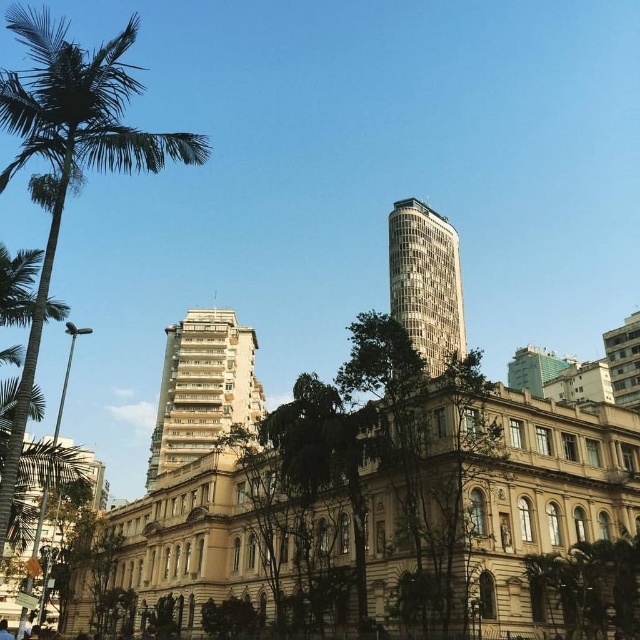
You are standing in the city square and see the green leafy palm tree at left and the silver glass tower at upper right. Which object is positioned more to the left side of the scene?

The green leafy palm tree at left is positioned more to the left side of the scene compared to the silver glass tower at upper right.

You are standing in the middle of the street looking at the white textured building at center and the silver glass tower at upper right. Which one is positioned to the left when viewed from your perspective?

The white textured building at center is positioned to the left of the silver glass tower at upper right from your perspective.